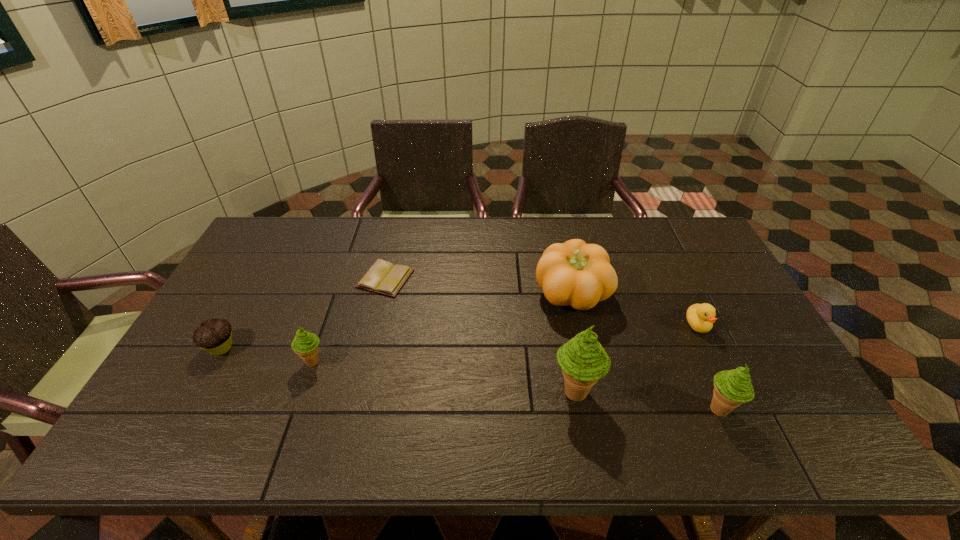
The width and height of the screenshot is (960, 540). What are the coordinates of `vacant area situated 0.050m on the back of the shortest icecream` in the screenshot? It's located at (322, 338).

I want to click on free location located on the right of the tallest icecream, so click(684, 392).

Where is `vacant space situated 0.380m on the back of the second shortest icecream`? The image size is (960, 540). vacant space situated 0.380m on the back of the second shortest icecream is located at coordinates (665, 288).

Locate an element on the screen. The image size is (960, 540). vacant region located on the right of the leftmost object is located at coordinates (355, 348).

The height and width of the screenshot is (540, 960). I want to click on free space located 0.260m on the left of the pumpkin, so click(449, 295).

I want to click on free region located 0.220m on the face of the duckling, so click(738, 407).

This screenshot has width=960, height=540. I want to click on vacant region located on the left of the diary, so click(x=273, y=279).

Find the location of a particular element. The width and height of the screenshot is (960, 540). object located in the left edge section of the desktop is located at coordinates (214, 335).

Where is `object that is at the right edge`? The width and height of the screenshot is (960, 540). object that is at the right edge is located at coordinates (700, 317).

Identify the location of vacant region at the far edge of the desktop. (564, 240).